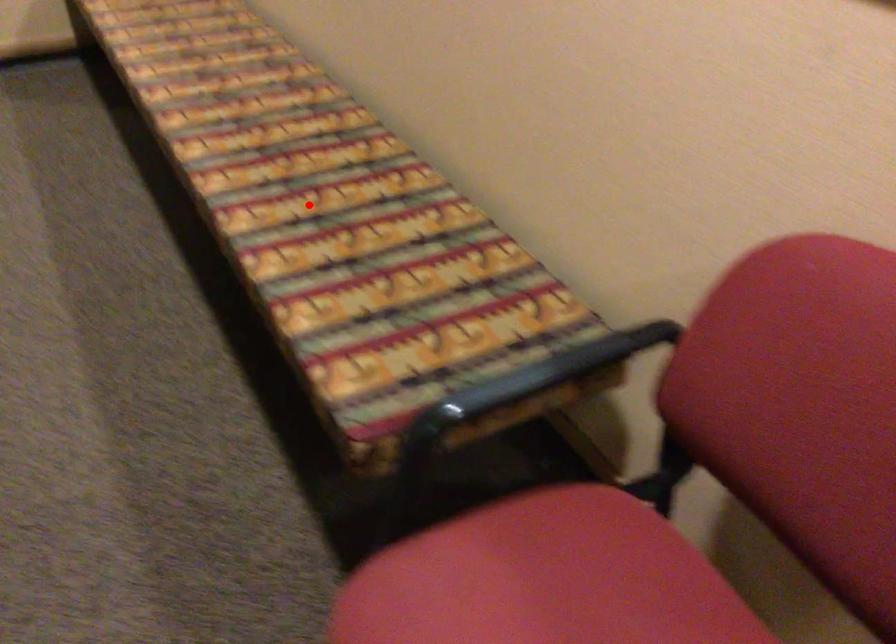
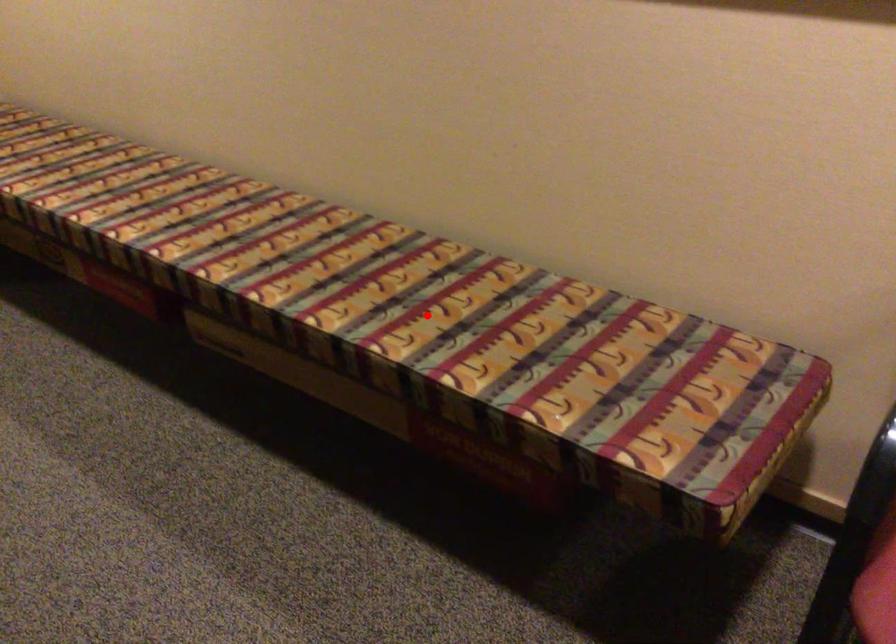
I am providing you with two images of the same scene from different viewpoints. A red point is marked on the first image and another point is marked on the second image. Are the points marked in image1 and image2 representing the same 3D position?

Yes